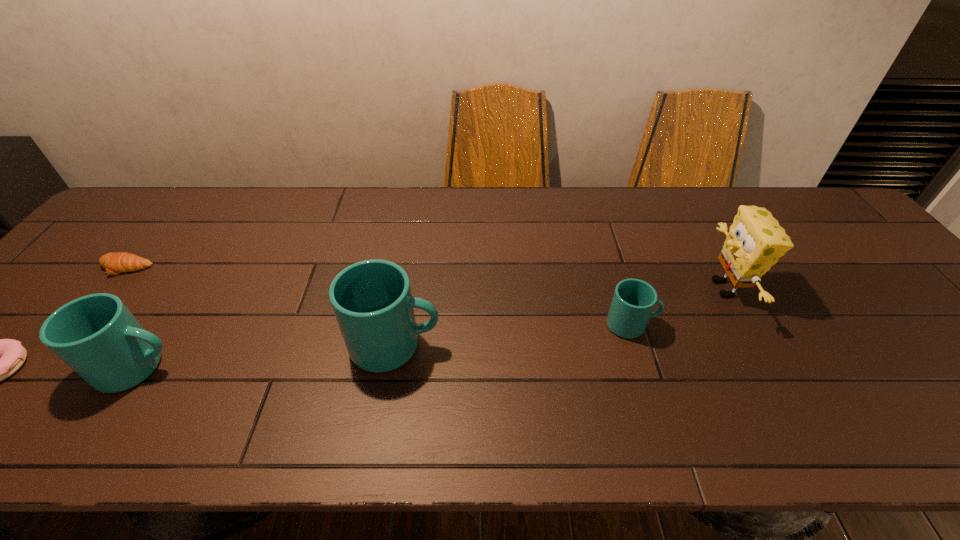
The height and width of the screenshot is (540, 960). Identify the location of free space for a new cup on the right. (849, 306).